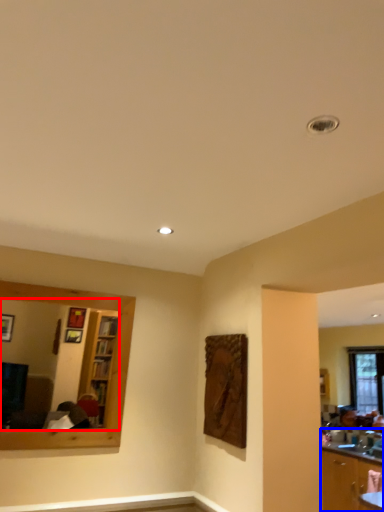
Question: Among these objects, which one is farthest to the camera, mirror (highlighted by a red box) or cabinetry (highlighted by a blue box)?

Choices:
 (A) mirror
 (B) cabinetry

Answer: (B)